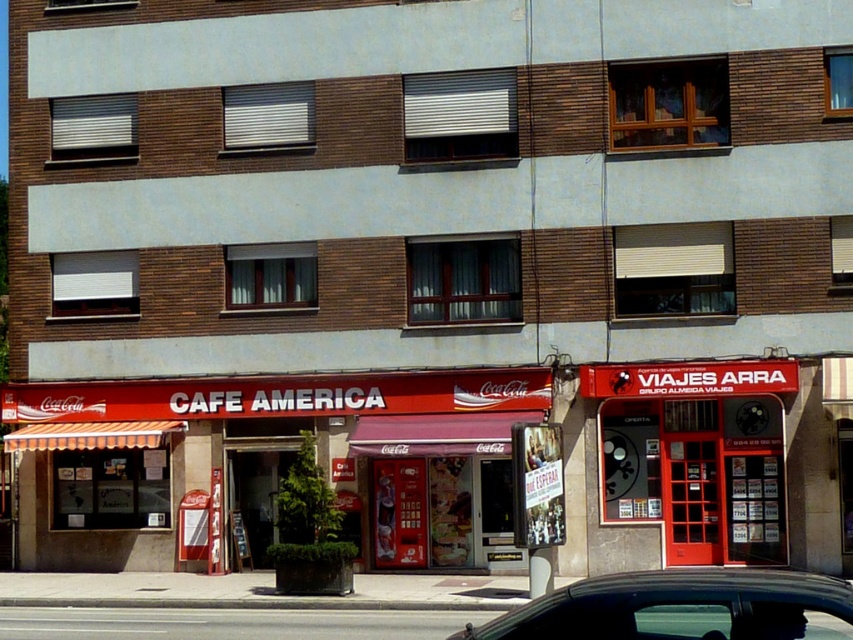
Is point (776, 433) positioned behind point (575, 600)?

Yes, it is.

Does red glass door at right come behind black glossy car at lower center?

Yes, it is.

Does point (689, 364) come behind point (721, 636)?

Yes, it is behind point (721, 636).

Find the location of a particular element. The height and width of the screenshot is (640, 853). red glass door at right is located at coordinates (695, 456).